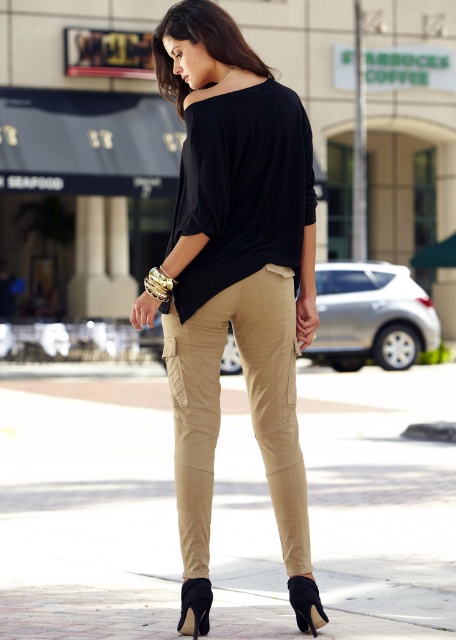
Is tan/cotton cargo pants at center above black suede sandal at lower right?

Yes, tan/cotton cargo pants at center is above black suede sandal at lower right.

Between point (253, 296) and point (295, 577), which one is positioned in front?

Point (295, 577) is in front.

Describe the element at coordinates (249, 408) in the screenshot. I see `tan/cotton cargo pants at center` at that location.

Find the location of a particular element. This screenshot has width=456, height=640. tan/cotton cargo pants at center is located at coordinates (249, 408).

Can you confirm if matte khaki pants at center is positioned to the right of black suede sandal at lower right?

In fact, matte khaki pants at center is to the left of black suede sandal at lower right.

Between matte khaki pants at center and black suede sandal at lower right, which one has more height?

matte khaki pants at center

This screenshot has height=640, width=456. In order to click on matte khaki pants at center in this screenshot , I will do [233, 266].

This screenshot has width=456, height=640. I want to click on matte khaki pants at center, so click(x=233, y=266).

Is point (285, 189) closer to viewer compared to point (210, 445)?

No, it is not.

Measure the distance between point (264, 195) and camera.

They are 18.48 feet apart.

Locate an element on the screen. Image resolution: width=456 pixels, height=640 pixels. matte khaki pants at center is located at coordinates (233, 266).